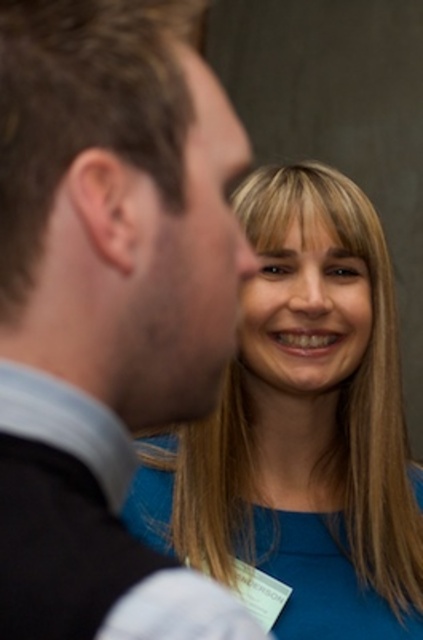
This screenshot has width=423, height=640. What do you see at coordinates (107, 305) in the screenshot? I see `dark brown hair at left` at bounding box center [107, 305].

Who is taller, dark brown hair at left or brown matte hair at upper left?

Standing taller between the two is dark brown hair at left.

Who is more forward, (x=181, y=301) or (x=24, y=17)?

Point (x=24, y=17) is in front.

Locate an element on the screen. The image size is (423, 640). dark brown hair at left is located at coordinates [107, 305].

Does dark brown hair at left have a greater height compared to blue fabric shirt at center?

No, dark brown hair at left is not taller than blue fabric shirt at center.

Which is behind, point (63, 253) or point (236, 372)?

The point (236, 372) is behind.

The height and width of the screenshot is (640, 423). I want to click on dark brown hair at left, so click(107, 305).

Locate an element on the screen. The height and width of the screenshot is (640, 423). dark brown hair at left is located at coordinates (107, 305).

Can you confirm if blue fabric shirt at center is positioned to the right of brown matte hair at upper left?

Indeed, blue fabric shirt at center is positioned on the right side of brown matte hair at upper left.

Can you confirm if blue fabric shirt at center is taller than brown matte hair at upper left?

Correct, blue fabric shirt at center is much taller as brown matte hair at upper left.

The image size is (423, 640). Describe the element at coordinates (304, 429) in the screenshot. I see `blue fabric shirt at center` at that location.

Find the location of a particular element. The width and height of the screenshot is (423, 640). blue fabric shirt at center is located at coordinates (304, 429).